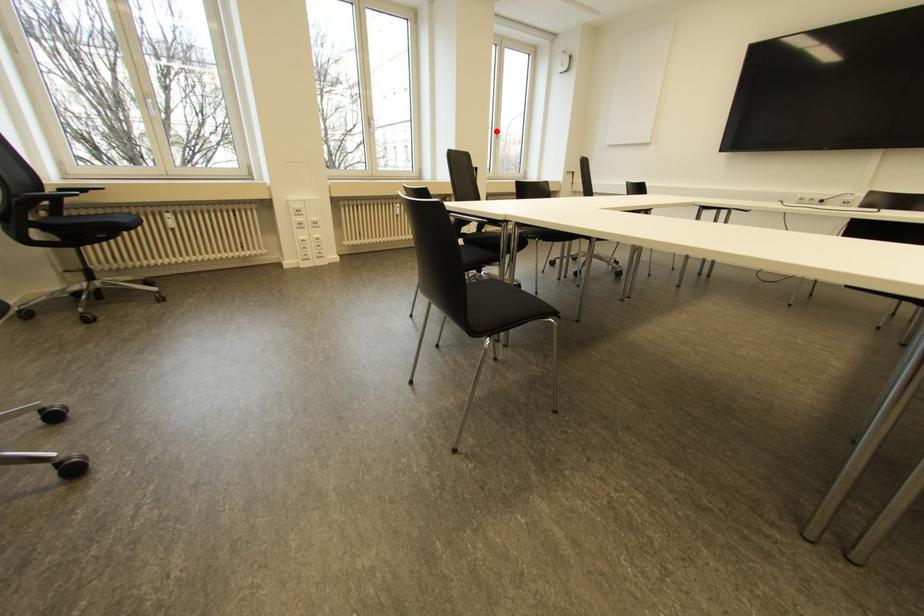
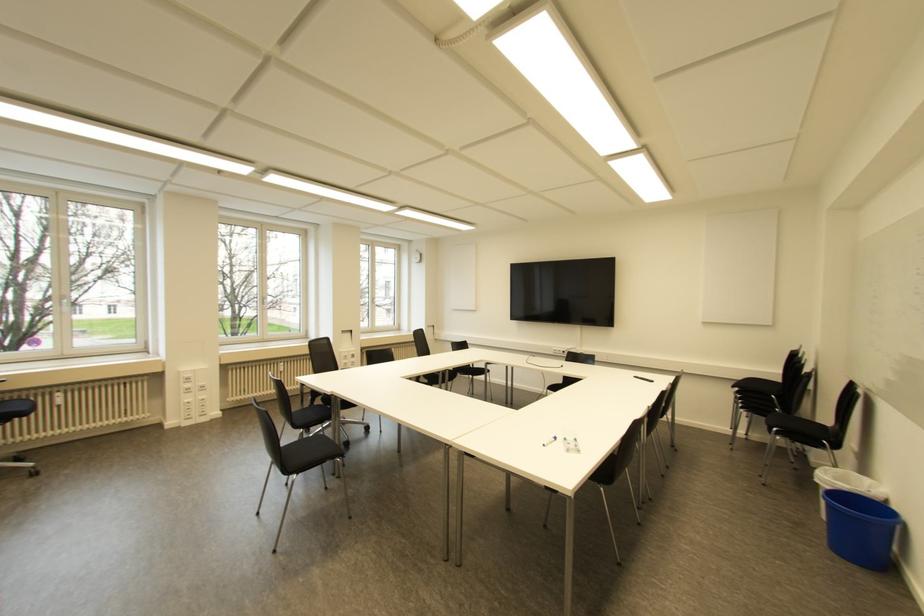
In the second image, find the point that corresponds to the highlighted location in the first image.

(372, 299)